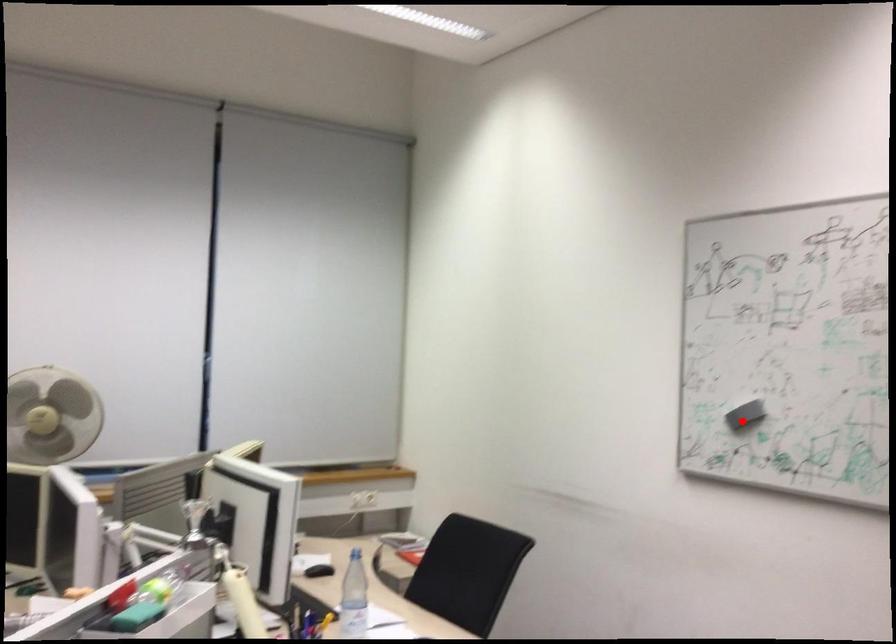
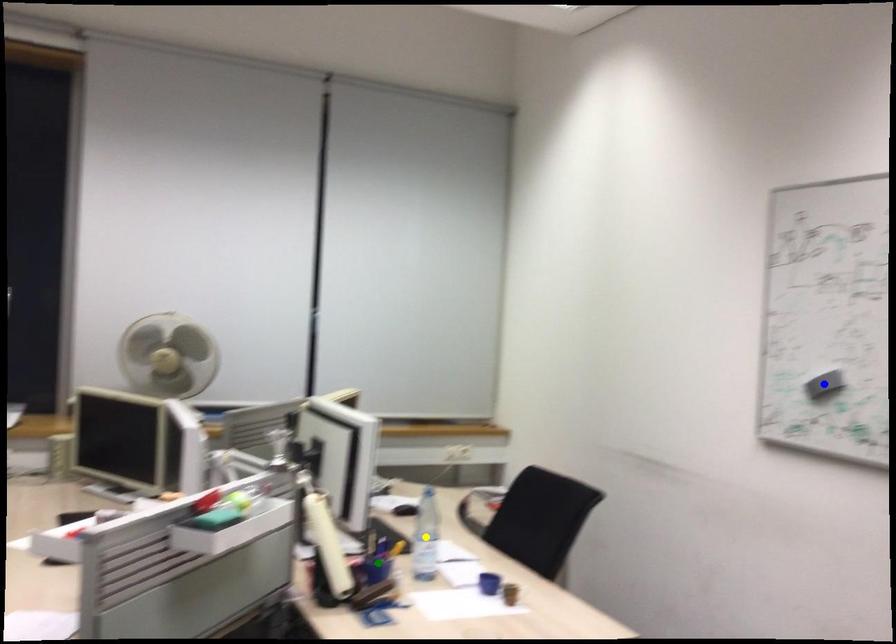
Question: I am providing you with two images of the same scene from different viewpoints. A red point is marked on the first image. You are given multiple points on the second image. Can you choose the point in image 2 that corresponds to the point in image 1?

Choices:
 (A) blue point
 (B) green point
 (C) yellow point

Answer: (A)